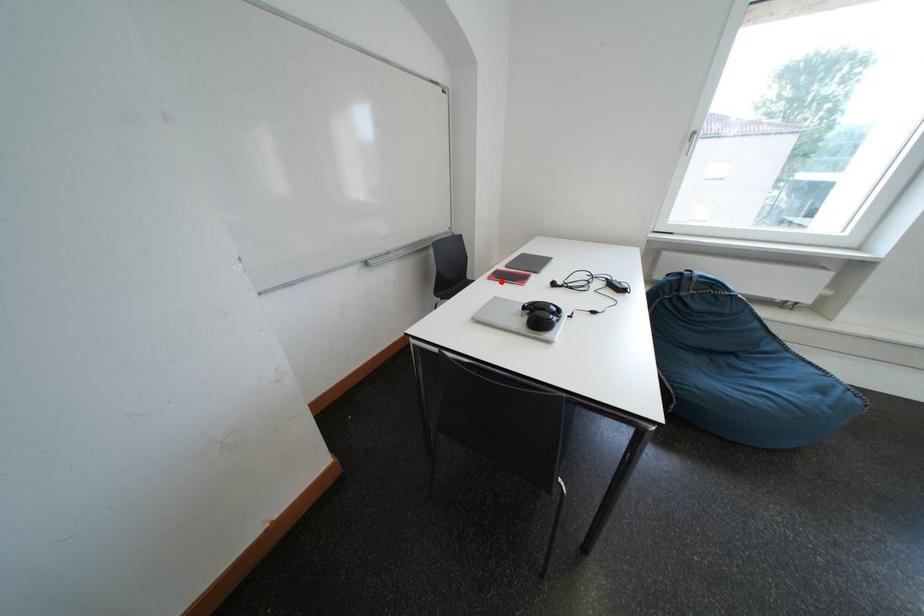
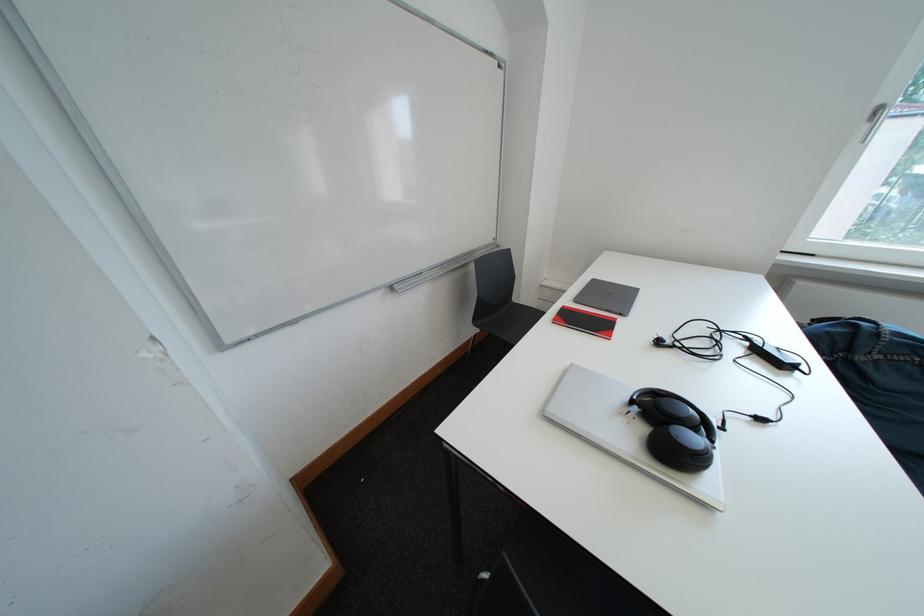
In the second image, find the point that corresponds to the highlighted location in the first image.

(565, 325)